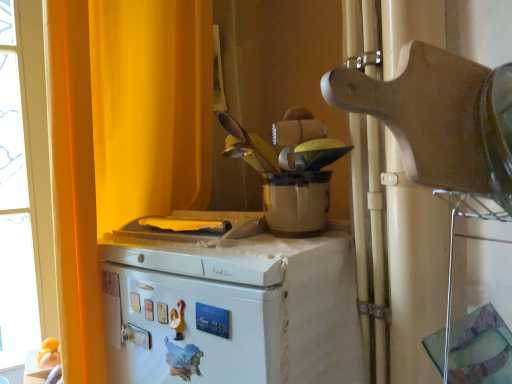
At what (x,y) coordinates should I click in order to perform the action: click on wooden cutting board at upper right, the second appliance from the back. Please return your answer as a coordinate pair (x, y). The height and width of the screenshot is (384, 512). Looking at the image, I should click on (439, 117).

Considering the points (149, 152) and (166, 304), which point is behind, point (149, 152) or point (166, 304)?

Point (149, 152)

Is yellow fabric curtain at upper left to the left of white matte refrigerator at center from the viewer's perspective?

Indeed, yellow fabric curtain at upper left is positioned on the left side of white matte refrigerator at center.

How different are the orientations of yellow fabric curtain at upper left and white matte refrigerator at center in degrees?

The angular difference between yellow fabric curtain at upper left and white matte refrigerator at center is 71.1 degrees.

Is yellow fabric curtain at upper left positioned before white matte refrigerator at center?

No, it is not.

Is white matte refrigerator at center next to yellow fabric curtain at upper left?

No, white matte refrigerator at center is not next to yellow fabric curtain at upper left.

From the image's perspective, is white matte refrigerator at center below yellow fabric curtain at upper left?

Yes, from the image's perspective, white matte refrigerator at center is below yellow fabric curtain at upper left.

I want to click on home appliance below the yellow fabric curtain at upper left (from a real-world perspective), so click(x=230, y=305).

Is white matte refrigerator at center positioned beyond the bounds of yellow fabric curtain at upper left?

That's correct, white matte refrigerator at center is outside of yellow fabric curtain at upper left.

Between matte white pot at center, marked as the 2th appliance in a front-to-back arrangement, and wooden cutting board at upper right, arranged as the first appliance when viewed from the front, which one has larger width?

With larger width is wooden cutting board at upper right, arranged as the first appliance when viewed from the front.

This screenshot has width=512, height=384. What are the coordinates of `appliance in front of the matte white pot at center, marked as the 2th appliance in a front-to-back arrangement` in the screenshot? It's located at (x=439, y=117).

Would you consider matte white pot at center, marked as the 2th appliance in a front-to-back arrangement, to be distant from wooden cutting board at upper right, arranged as the first appliance when viewed from the front?

No, matte white pot at center, marked as the 2th appliance in a front-to-back arrangement, is in close proximity to wooden cutting board at upper right, arranged as the first appliance when viewed from the front.

From the picture: From a real-world perspective, who is located higher, matte white pot at center, marked as the 2th appliance in a front-to-back arrangement, or wooden cutting board at upper right, arranged as the first appliance when viewed from the front?

wooden cutting board at upper right, arranged as the first appliance when viewed from the front, from a real-world perspective.

Does matte white pot at center, the first appliance positioned from the back, have a smaller size compared to yellow fabric curtain at upper left?

Indeed, matte white pot at center, the first appliance positioned from the back, has a smaller size compared to yellow fabric curtain at upper left.

Is matte white pot at center, the first appliance positioned from the back, inside the boundaries of yellow fabric curtain at upper left, or outside?

matte white pot at center, the first appliance positioned from the back, lies outside yellow fabric curtain at upper left.

This screenshot has width=512, height=384. I want to click on curtain located behind the matte white pot at center, the first appliance positioned from the back, so click(x=121, y=139).

From the image's perspective, which one is positioned lower, matte white pot at center, the first appliance positioned from the back, or yellow fabric curtain at upper left?

yellow fabric curtain at upper left is shown below in the image.

I want to click on home appliance below the wooden cutting board at upper right, arranged as the first appliance when viewed from the front (from a real-world perspective), so click(x=230, y=305).

Is wooden cutting board at upper right, the second appliance from the back, in contact with white matte refrigerator at center?

wooden cutting board at upper right, the second appliance from the back, and white matte refrigerator at center are not in contact.

From a real-world perspective, between wooden cutting board at upper right, the second appliance from the back, and white matte refrigerator at center, who is vertically lower?

From a 3D spatial view, white matte refrigerator at center is below.

Is point (321, 147) more distant than point (152, 254)?

No, (321, 147) is closer to viewer.

Is matte white pot at center, the first appliance positioned from the back, further to the viewer compared to white matte refrigerator at center?

Yes, it is behind white matte refrigerator at center.

Are matte white pot at center, marked as the 2th appliance in a front-to-back arrangement, and white matte refrigerator at center located far from each other?

matte white pot at center, marked as the 2th appliance in a front-to-back arrangement, is near white matte refrigerator at center, not far away.

From the image's perspective, which object appears higher, wooden cutting board at upper right, the second appliance from the back, or yellow fabric curtain at upper left?

wooden cutting board at upper right, the second appliance from the back, appears higher in the image.

Where is `curtain below the wooden cutting board at upper right, the second appliance from the back (from the image's perspective)`? The image size is (512, 384). curtain below the wooden cutting board at upper right, the second appliance from the back (from the image's perspective) is located at coordinates (121, 139).

From the picture: Do you think wooden cutting board at upper right, arranged as the first appliance when viewed from the front, is within yellow fabric curtain at upper left, or outside of it?

wooden cutting board at upper right, arranged as the first appliance when viewed from the front, cannot be found inside yellow fabric curtain at upper left.

Identify the location of curtain located on the left of white matte refrigerator at center. (121, 139).

The width and height of the screenshot is (512, 384). I want to click on curtain above the white matte refrigerator at center (from the image's perspective), so 121,139.

Looking at the image, which one is located further to matte white pot at center, marked as the 2th appliance in a front-to-back arrangement, yellow fabric curtain at upper left or white matte refrigerator at center?

yellow fabric curtain at upper left is further to matte white pot at center, marked as the 2th appliance in a front-to-back arrangement.

Looking at the image, which one is located closer to white matte refrigerator at center, yellow fabric curtain at upper left or matte white pot at center, the first appliance positioned from the back?

Based on the image, matte white pot at center, the first appliance positioned from the back, appears to be nearer to white matte refrigerator at center.

Estimate the real-world distances between objects in this image. Which object is closer to white matte refrigerator at center, wooden cutting board at upper right, arranged as the first appliance when viewed from the front, or matte white pot at center, marked as the 2th appliance in a front-to-back arrangement?

matte white pot at center, marked as the 2th appliance in a front-to-back arrangement.

When comparing their distances from wooden cutting board at upper right, arranged as the first appliance when viewed from the front, does yellow fabric curtain at upper left or matte white pot at center, marked as the 2th appliance in a front-to-back arrangement, seem further?

Based on the image, yellow fabric curtain at upper left appears to be further to wooden cutting board at upper right, arranged as the first appliance when viewed from the front.

Estimate the real-world distances between objects in this image. Which object is closer to yellow fabric curtain at upper left, matte white pot at center, the first appliance positioned from the back, or white matte refrigerator at center?

The object closer to yellow fabric curtain at upper left is white matte refrigerator at center.

When comparing their distances from yellow fabric curtain at upper left, does wooden cutting board at upper right, arranged as the first appliance when viewed from the front, or matte white pot at center, the first appliance positioned from the back, seem further?

wooden cutting board at upper right, arranged as the first appliance when viewed from the front, is further to yellow fabric curtain at upper left.

Looking at the image, which one is located further to wooden cutting board at upper right, the second appliance from the back, yellow fabric curtain at upper left or white matte refrigerator at center?

yellow fabric curtain at upper left lies further to wooden cutting board at upper right, the second appliance from the back, than the other object.

From the image, which object appears to be farther from white matte refrigerator at center, wooden cutting board at upper right, the second appliance from the back, or yellow fabric curtain at upper left?

Among the two, wooden cutting board at upper right, the second appliance from the back, is located further to white matte refrigerator at center.

Find the location of `appliance between yellow fabric curtain at upper left and wooden cutting board at upper right, the second appliance from the back, from left to right`. appliance between yellow fabric curtain at upper left and wooden cutting board at upper right, the second appliance from the back, from left to right is located at coordinates (290, 170).

This screenshot has width=512, height=384. In order to click on appliance between wooden cutting board at upper right, arranged as the first appliance when viewed from the front, and white matte refrigerator at center, in the vertical direction in this screenshot , I will do (x=290, y=170).

This screenshot has width=512, height=384. Identify the location of curtain between matte white pot at center, the first appliance positioned from the back, and white matte refrigerator at center, in the vertical direction. (121, 139).

Locate an element on the screen. The width and height of the screenshot is (512, 384). home appliance between yellow fabric curtain at upper left and wooden cutting board at upper right, the second appliance from the back, from left to right is located at coordinates (230, 305).